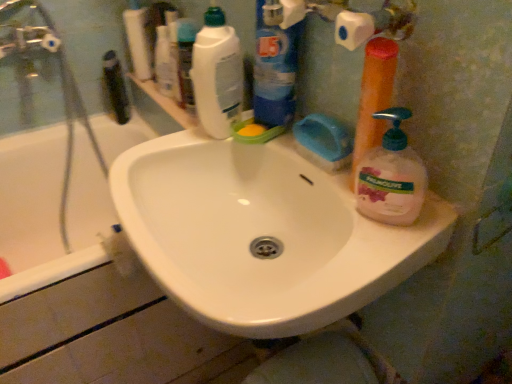
Locate an element on the screen. Image resolution: width=512 pixels, height=384 pixels. vacant area situated to the left side of white glossy bottle at upper center, which is the 1th cleaning product from left to right is located at coordinates 166,144.